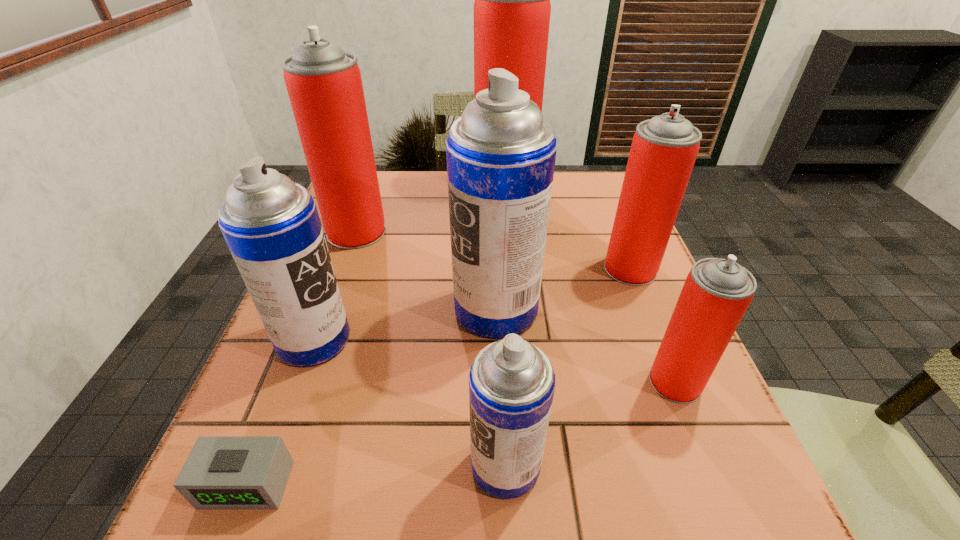
Where is `vacant area at the right edge of the desktop`? The image size is (960, 540). vacant area at the right edge of the desktop is located at coordinates (660, 402).

Locate an element on the screen. The height and width of the screenshot is (540, 960). blank space at the far right corner of the desktop is located at coordinates (592, 171).

Image resolution: width=960 pixels, height=540 pixels. Identify the location of vacant space that's between the nearest aerosol can and the nearest red aerosol can. (590, 424).

Find the location of a particular element. This screenshot has width=960, height=540. free area in between the nearest red aerosol can and the nearest aerosol can is located at coordinates (590, 424).

Where is `vacant space that is in between the farthest object and the leftmost blue aerosol can`? vacant space that is in between the farthest object and the leftmost blue aerosol can is located at coordinates (409, 263).

Find the location of a particular element. The height and width of the screenshot is (540, 960). free space between the second biggest blue aerosol can and the shortest object is located at coordinates (280, 412).

The width and height of the screenshot is (960, 540). I want to click on free spot between the biggest blue aerosol can and the shortest object, so click(372, 396).

The height and width of the screenshot is (540, 960). What are the coordinates of `free spot between the second biggest blue aerosol can and the farthest object` in the screenshot? It's located at (409, 263).

This screenshot has width=960, height=540. In order to click on vacant area that lies between the third biggest red aerosol can and the biggest blue aerosol can in this screenshot , I will do `click(564, 289)`.

The width and height of the screenshot is (960, 540). I want to click on vacant space that is in between the alarm clock and the biggest blue aerosol can, so click(x=372, y=396).